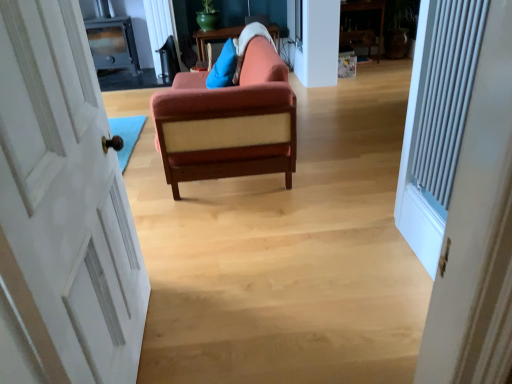
Measure the distance between point (44, 108) and camera.

Point (44, 108) is 38.70 inches away from camera.

Measure the distance between point (189, 110) and camera.

The distance of point (189, 110) from camera is 2.18 meters.

The width and height of the screenshot is (512, 384). Identify the location of white textured radiator at right. (447, 96).

Where is `white painted wood door at left`? white painted wood door at left is located at coordinates (62, 210).

Is teal ceramic pot at upper center not near blue fabric pillow at upper center?

teal ceramic pot at upper center is positioned a significant distance from blue fabric pillow at upper center.

Does point (202, 18) come farther from viewer compared to point (224, 50)?

Yes, point (202, 18) is behind point (224, 50).

Locate an element on the screen. teal above the blue fabric pillow at upper center (from the image's perspective) is located at coordinates (208, 16).

Which object is more forward, teal ceramic pot at upper center or blue fabric pillow at upper center?

blue fabric pillow at upper center is more forward.

Measure the distance from metallic wood stove at upper left to white textured radiator at right.

The distance of metallic wood stove at upper left from white textured radiator at right is 4.97 meters.

From a real-world perspective, which is physically below, metallic wood stove at upper left or white textured radiator at right?

metallic wood stove at upper left.

Is point (125, 44) positioned in front of point (437, 114)?

No, it is not.

Can you confirm if metallic wood stove at upper left is thinner than white textured radiator at right?

No, metallic wood stove at upper left is not thinner than white textured radiator at right.

In the scene shown: Is teal ceramic pot at upper center in front of white painted wood door at left?

No.

Looking at their sizes, would you say teal ceramic pot at upper center is wider or thinner than white painted wood door at left?

Clearly, teal ceramic pot at upper center has more width compared to white painted wood door at left.

Which is more distant, (208, 23) or (122, 198)?

The point (208, 23) is behind.

Which of these two, metallic wood stove at upper left or teal ceramic pot at upper center, is wider?

Wider between the two is metallic wood stove at upper left.

Is metallic wood stove at upper left aimed at teal ceramic pot at upper center?

No.

From a real-world perspective, which is physically below, metallic wood stove at upper left or teal ceramic pot at upper center?

metallic wood stove at upper left is physically lower.

Is metallic wood stove at upper left taller or shorter than teal ceramic pot at upper center?

Considering their sizes, metallic wood stove at upper left has more height than teal ceramic pot at upper center.

Can you confirm if velvet orange couch at center is thinner than teal ceramic pot at upper center?

In fact, velvet orange couch at center might be wider than teal ceramic pot at upper center.

Considering the positions of objects velvet orange couch at center and teal ceramic pot at upper center in the image provided, who is more to the left, velvet orange couch at center or teal ceramic pot at upper center?

teal ceramic pot at upper center.

Is velvet orange couch at center further to the viewer compared to teal ceramic pot at upper center?

No, the depth of velvet orange couch at center is less than that of teal ceramic pot at upper center.

Is velvet orange couch at center not within teal ceramic pot at upper center?

Indeed, velvet orange couch at center is completely outside teal ceramic pot at upper center.

From the image's perspective, who appears lower, velvet orange couch at center or white painted wood door at left?

white painted wood door at left, from the image's perspective.

Measure the distance from velvet orange couch at center to white painted wood door at left.

They are 1.01 meters apart.

Is velvet orange couch at center bigger than white painted wood door at left?

Indeed, velvet orange couch at center has a larger size compared to white painted wood door at left.

Which object is thinner, velvet orange couch at center or white painted wood door at left?

white painted wood door at left.

How much distance is there between white painted wood door at left and blue fabric pillow at upper center?

A distance of 5.88 feet exists between white painted wood door at left and blue fabric pillow at upper center.

From the image's perspective, which is below, white painted wood door at left or blue fabric pillow at upper center?

From the image's view, white painted wood door at left is below.

Is white painted wood door at left in front of or behind blue fabric pillow at upper center in the image?

white painted wood door at left is in front of blue fabric pillow at upper center.

Is white painted wood door at left next to blue fabric pillow at upper center and touching it?

No, white painted wood door at left is not with blue fabric pillow at upper center.

Where is `pillow that appears below the teal ceramic pot at upper center (from the image's perspective)`? The width and height of the screenshot is (512, 384). pillow that appears below the teal ceramic pot at upper center (from the image's perspective) is located at coordinates (223, 67).

The height and width of the screenshot is (384, 512). I want to click on entertainment center above the white textured radiator at right (from the image's perspective), so click(x=113, y=44).

Based on their spatial positions, is white textured radiator at right or white painted wood door at left closer to teal ceramic pot at upper center?

white textured radiator at right lies closer to teal ceramic pot at upper center than the other object.

Looking at the image, which one is located further to velvet orange couch at center, blue fabric pillow at upper center or teal ceramic pot at upper center?

Among the two, teal ceramic pot at upper center is located further to velvet orange couch at center.

Looking at the image, which one is located further to blue fabric pillow at upper center, velvet orange couch at center or metallic wood stove at upper left?

metallic wood stove at upper left is further to blue fabric pillow at upper center.

Estimate the real-world distances between objects in this image. Which object is closer to teal ceramic pot at upper center, white textured radiator at right or velvet orange couch at center?

velvet orange couch at center is positioned closer to the anchor teal ceramic pot at upper center.

Considering their positions, is teal ceramic pot at upper center positioned closer to velvet orange couch at center than metallic wood stove at upper left?

teal ceramic pot at upper center.

Estimate the real-world distances between objects in this image. Which object is closer to white textured radiator at right, metallic wood stove at upper left or velvet orange couch at center?

velvet orange couch at center is positioned closer to the anchor white textured radiator at right.

From the image, which object appears to be farther from white painted wood door at left, metallic wood stove at upper left or velvet orange couch at center?

metallic wood stove at upper left lies further to white painted wood door at left than the other object.

From the image, which object appears to be nearer to blue fabric pillow at upper center, white painted wood door at left or teal ceramic pot at upper center?

white painted wood door at left is closer to blue fabric pillow at upper center.

Where is `radiator positioned between white painted wood door at left and metallic wood stove at upper left from near to far`? The width and height of the screenshot is (512, 384). radiator positioned between white painted wood door at left and metallic wood stove at upper left from near to far is located at coordinates (447, 96).

Locate an element on the screen. This screenshot has height=384, width=512. teal between blue fabric pillow at upper center and metallic wood stove at upper left from front to back is located at coordinates (208, 16).

Identify the location of pillow positioned between white textured radiator at right and metallic wood stove at upper left from near to far. (223, 67).

Locate an element on the screen. pillow between velvet orange couch at center and teal ceramic pot at upper center in the front-back direction is located at coordinates 223,67.